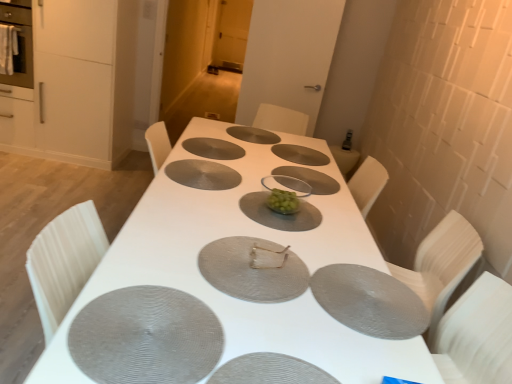
Find the location of `vacant area that lies between gray textured placemat at center, the 5th pizza pan in the front-to-back sequence, and clear plastic plate at center`. vacant area that lies between gray textured placemat at center, the 5th pizza pan in the front-to-back sequence, and clear plastic plate at center is located at coordinates (252, 173).